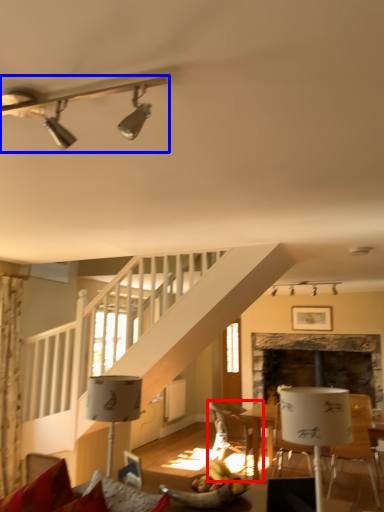
Question: Which object appears closest to the camera in this image, chair (highlighted by a red box) or lamp (highlighted by a blue box)?

Choices:
 (A) chair
 (B) lamp

Answer: (B)